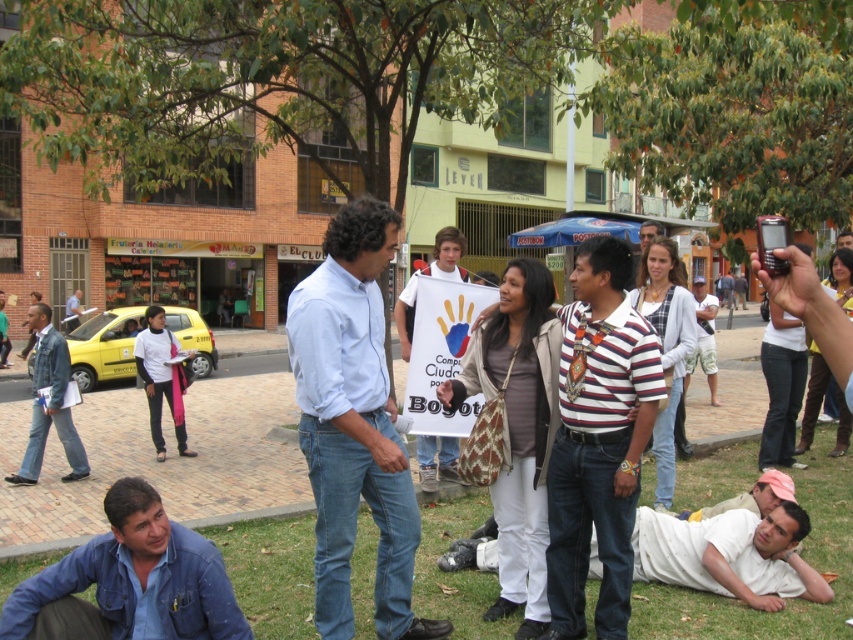
Question: Estimate the real-world distances between objects in this image. Which object is farther from the green grass at lower center?

Choices:
 (A) light blue denim jeans at center
 (B) blue denim shirt at lower left
 (C) white paper sign at center
 (D) striped cotton shirt at center

Answer: (D)

Question: Based on their relative distances, which object is farther from the blue denim shirt at lower left?

Choices:
 (A) white paper sign at center
 (B) light blue denim jeans at center
 (C) striped cotton shirt at center
 (D) denim jacket at left

Answer: (D)

Question: Is green grass at lower center in front of light blue denim jeans at center?

Choices:
 (A) no
 (B) yes

Answer: (A)

Question: Does denim jacket at left appear on the right side of white paper sign at center?

Choices:
 (A) no
 (B) yes

Answer: (A)

Question: Observing the image, what is the correct spatial positioning of striped cotton shirt at center in reference to white cotton shirt at lower right?

Choices:
 (A) below
 (B) above

Answer: (B)

Question: Estimate the real-world distances between objects in this image. Which object is farther from the blue denim shirt at lower left?

Choices:
 (A) green grass at lower center
 (B) striped cotton shirt at center
 (C) denim jacket at left
 (D) light blue denim jeans at center

Answer: (C)